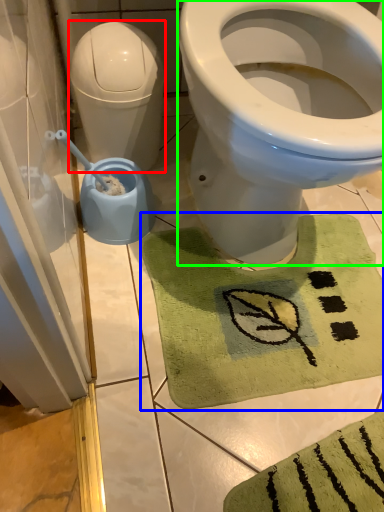
Question: Which object is the farthest from water tank (highlighted by a red box)? Choose among these: bath mat (highlighted by a blue box) or bidet (highlighted by a green box).

Choices:
 (A) bath mat
 (B) bidet

Answer: (A)